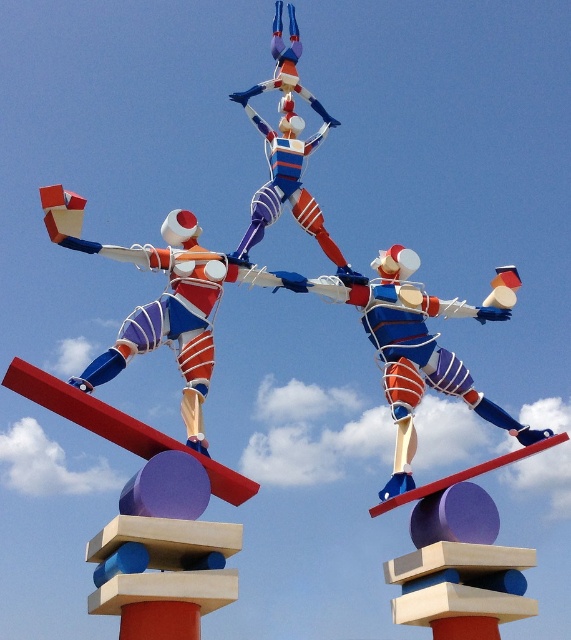
You are an art critic analyzing the sculpture. You notice two central figures, the metallic blue and white figure at center and the shiny metallic figure at center. Which one is positioned to the right?

The metallic blue and white figure at center is positioned to the right of the shiny metallic figure at center.

Looking at this image, you are an art critic analyzing the sculpture. You notice two figures at the center of the sculpture, the metallic blue and white figure at center and the matte plastic figure at center. Which one is positioned lower in the sculpture?

The metallic blue and white figure at center is located below the matte plastic figure at center, so it is positioned lower in the sculpture.

You are an art curator planning to display the matte plastic figure at center and the shiny metallic figure at center in a new exhibition. Given their widths, which figure requires a wider base to prevent tipping over?

The matte plastic figure at center requires a wider base because its width surpasses that of the shiny metallic figure at center, making it potentially less stable.